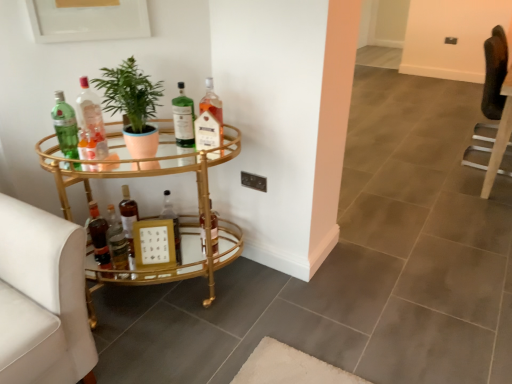
Question: From the image's perspective, is shiny brown bottle at lower left, positioned as the ninth bottle in right-to-left order, over green glass bottle at center, the 3th bottle in the right-to-left sequence?

Choices:
 (A) no
 (B) yes

Answer: (A)

Question: Considering the relative sizes of shiny brown bottle at lower left, positioned as the ninth bottle in right-to-left order, and green glass bottle at center, arranged as the eighth bottle when viewed from the left, in the image provided, is shiny brown bottle at lower left, positioned as the ninth bottle in right-to-left order, shorter than green glass bottle at center, arranged as the eighth bottle when viewed from the left,?

Choices:
 (A) yes
 (B) no

Answer: (A)

Question: Does shiny brown bottle at lower left, the second bottle when ordered from left to right, come in front of green glass bottle at center, arranged as the eighth bottle when viewed from the left?

Choices:
 (A) yes
 (B) no

Answer: (B)

Question: Considering the relative sizes of shiny brown bottle at lower left, positioned as the ninth bottle in right-to-left order, and green glass bottle at center, the 3th bottle in the right-to-left sequence, in the image provided, is shiny brown bottle at lower left, positioned as the ninth bottle in right-to-left order, thinner than green glass bottle at center, the 3th bottle in the right-to-left sequence,?

Choices:
 (A) yes
 (B) no

Answer: (B)

Question: Could green glass bottle at center, the 3th bottle in the right-to-left sequence, be considered to be inside shiny brown bottle at lower left, positioned as the ninth bottle in right-to-left order?

Choices:
 (A) no
 (B) yes

Answer: (A)

Question: From the image's perspective, is translucent glass bottle at center, the tenth bottle positioned from the left, positioned above or below shiny brown bottle at lower left, the second bottle when ordered from left to right?

Choices:
 (A) above
 (B) below

Answer: (A)

Question: Considering the positions of point (216, 155) and point (94, 244), is point (216, 155) closer or farther from the camera than point (94, 244)?

Choices:
 (A) closer
 (B) farther

Answer: (A)

Question: From a real-world perspective, is translucent glass bottle at center, the 1th bottle viewed from the right, positioned above or below shiny brown bottle at lower left, the second bottle when ordered from left to right?

Choices:
 (A) below
 (B) above

Answer: (B)

Question: Which is correct: translucent glass bottle at center, the 1th bottle viewed from the right, is inside shiny brown bottle at lower left, positioned as the ninth bottle in right-to-left order, or outside of it?

Choices:
 (A) outside
 (B) inside

Answer: (A)

Question: Based on their positions, is translucent glass bottle at center, placed as the fourth bottle when sorted from right to left, located to the left or right of green glass bottle at upper left, which is counted as the 10th bottle, starting from the right?

Choices:
 (A) right
 (B) left

Answer: (A)

Question: Do you think translucent glass bottle at center, arranged as the 7th bottle when viewed from the left, is within green glass bottle at upper left, which is counted as the 10th bottle, starting from the right, or outside of it?

Choices:
 (A) outside
 (B) inside

Answer: (A)

Question: From a real-world perspective, is translucent glass bottle at center, placed as the fourth bottle when sorted from right to left, positioned above or below green glass bottle at upper left, which is counted as the 10th bottle, starting from the right?

Choices:
 (A) above
 (B) below

Answer: (B)

Question: Is translucent glass bottle at center, arranged as the 7th bottle when viewed from the left, taller or shorter than green glass bottle at upper left, which is counted as the 10th bottle, starting from the right?

Choices:
 (A) short
 (B) tall

Answer: (A)

Question: Looking at their shapes, would you say gold metallic swivel chair at left, the 1th swivel chair when ordered from bottom to top, is wider or thinner than translucent glass bottle at center, the 1th bottle viewed from the right?

Choices:
 (A) thin
 (B) wide

Answer: (B)

Question: From the image's perspective, is gold metallic swivel chair at left, positioned as the 1th swivel chair in front-to-back order, positioned above or below translucent glass bottle at center, the tenth bottle positioned from the left?

Choices:
 (A) above
 (B) below

Answer: (B)